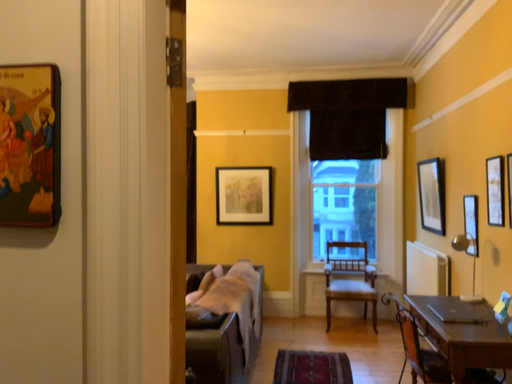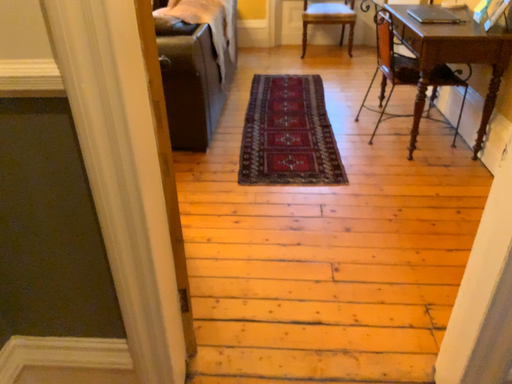
Question: How did the camera likely rotate when shooting the video?

Choices:
 (A) rotated downward
 (B) rotated upward

Answer: (A)